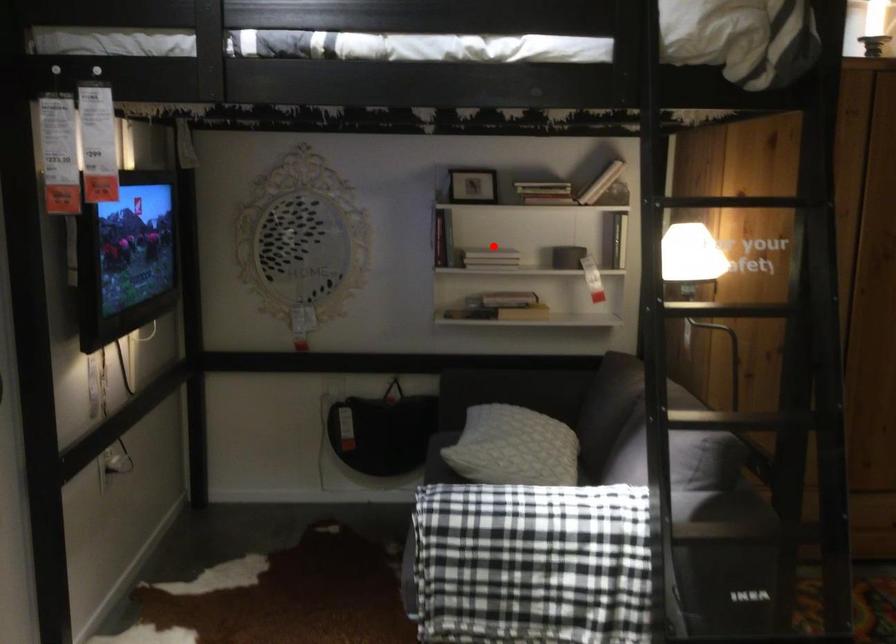
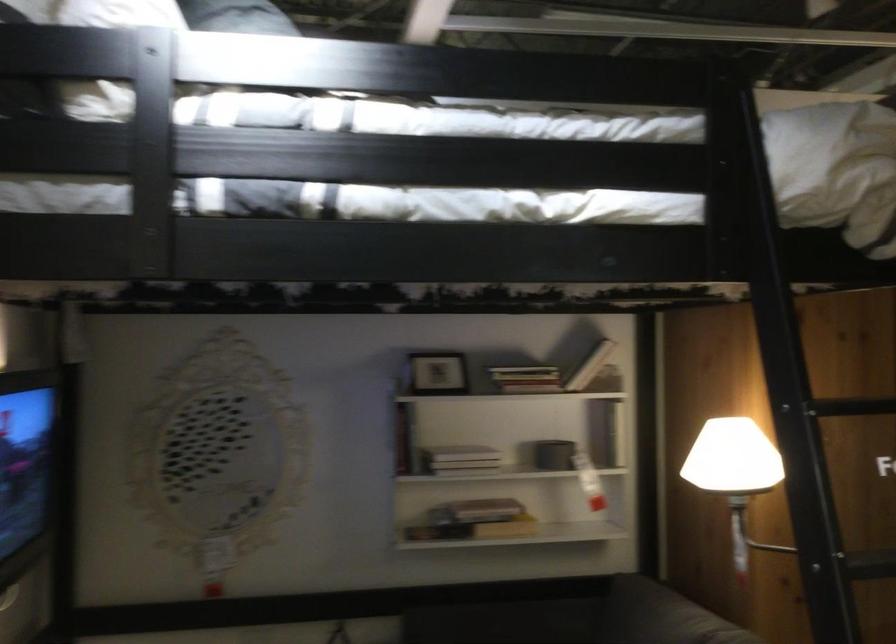
Question: I am providing you with two images of the same scene from different viewpoints. In image1, a red point is highlighted. Considering the same 3D point in image2, which of the following is correct?

Choices:
 (A) It is closer
 (B) It is farther

Answer: (A)